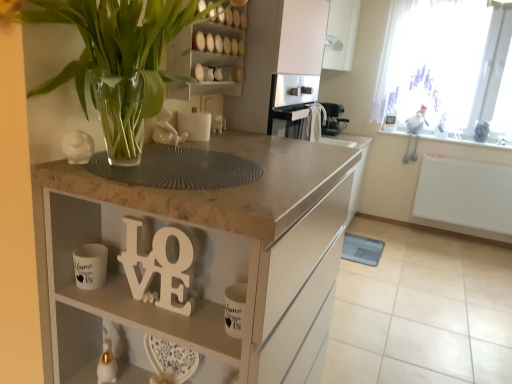
Question: Is point (306, 41) closer or farther from the camera than point (328, 117)?

Choices:
 (A) farther
 (B) closer

Answer: (B)

Question: From a real-world perspective, is white matte cabinet at upper center physically located above or below black plastic coffee machine at upper right?

Choices:
 (A) below
 (B) above

Answer: (B)

Question: Estimate the real-world distances between objects in this image. Which object is closer to the white sheer curtain at upper right?

Choices:
 (A) clear glass vase at upper left
 (B) white matte cabinet at upper center
 (C) white matte wooden letters at center
 (D) matte stone countertop at center
 (E) white glossy mug at lower left

Answer: (B)

Question: Considering the real-world distances, which object is farthest from the white sheer curtain at upper right?

Choices:
 (A) matte stone countertop at center
 (B) black plastic coffee machine at upper right
 (C) clear glass vase at upper left
 (D) white matte wooden letters at center
 (E) wooden shelves at upper center

Answer: (D)